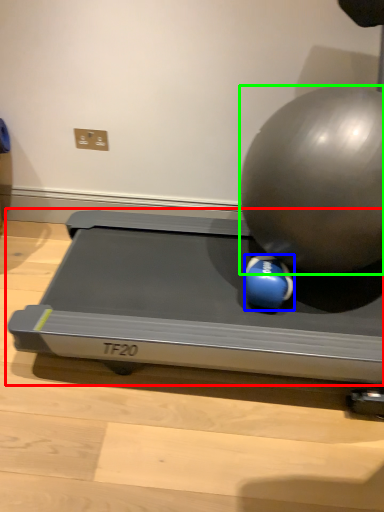
Question: Which object is the farthest from treadmill (highlighted by a red box)? Choose among these: ball (highlighted by a blue box) or ball (highlighted by a green box).

Choices:
 (A) ball
 (B) ball

Answer: (B)